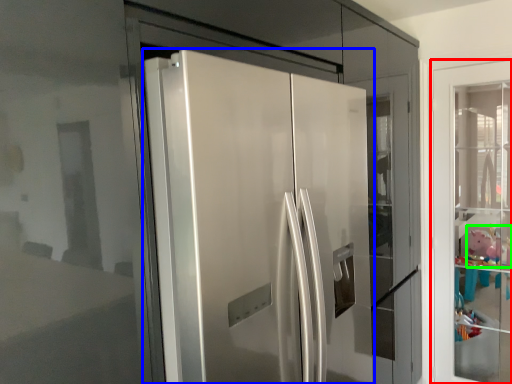
Question: Which is farther away from door (highlighted by a red box)? door (highlighted by a blue box) or toy (highlighted by a green box)?

Choices:
 (A) door
 (B) toy

Answer: (B)